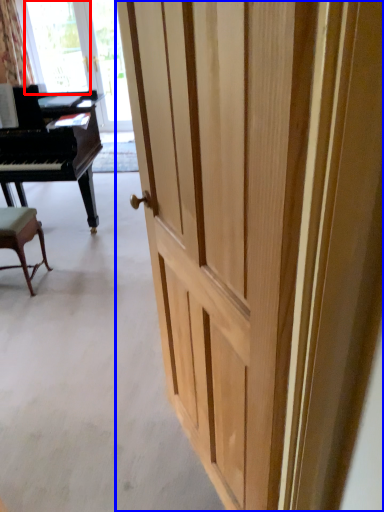
Question: Which point is closer to the camera, window screen (highlighted by a red box) or door (highlighted by a blue box)?

Choices:
 (A) window screen
 (B) door

Answer: (B)